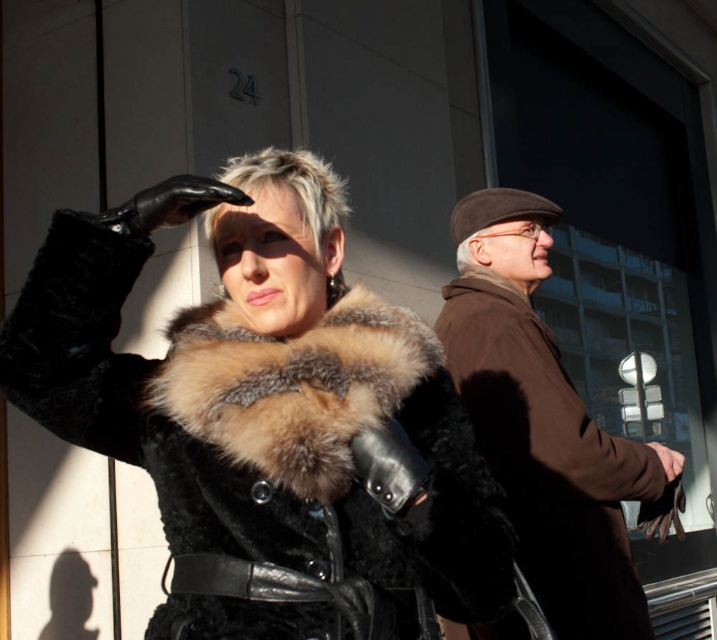
Question: Based on their relative distances, which object is nearer to the brown woolen coat at right?

Choices:
 (A) fur coat at center
 (B) brown fur coat at center

Answer: (B)

Question: Can you confirm if fur coat at center is positioned above brown woolen coat at right?

Choices:
 (A) yes
 (B) no

Answer: (A)

Question: Based on their relative distances, which object is farther from the brown fur coat at center?

Choices:
 (A) fur coat at center
 (B) brown woolen coat at right

Answer: (B)

Question: Does brown woolen coat at right appear under brown fur coat at center?

Choices:
 (A) yes
 (B) no

Answer: (A)

Question: Which of the following is the closest to the observer?

Choices:
 (A) fur coat at center
 (B) brown fur coat at center

Answer: (B)

Question: Where is fur coat at center located in relation to brown fur coat at center in the image?

Choices:
 (A) above
 (B) below

Answer: (B)